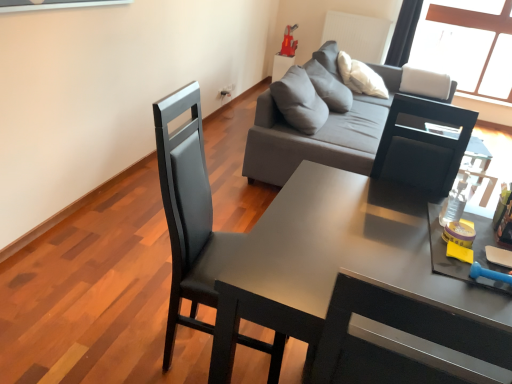
Find the location of a particular element. matte black chair at center-left is located at coordinates (188, 213).

Locate an element on the screen. The width and height of the screenshot is (512, 384). gray fabric side table at upper center is located at coordinates (281, 65).

Looking at this image, what is the approximate width of rubberized red toy at upper center?

The width of rubberized red toy at upper center is 9.20 inches.

This screenshot has height=384, width=512. Describe the element at coordinates (289, 42) in the screenshot. I see `rubberized red toy at upper center` at that location.

Describe the element at coordinates (318, 136) in the screenshot. I see `gray fabric couch at upper center` at that location.

At what (x,y) coordinates should I click in order to perform the action: click on matte black chair at center-left. Please return your answer as a coordinate pair (x, y). The width and height of the screenshot is (512, 384). Looking at the image, I should click on (188, 213).

From a real-world perspective, is gray fabric side table at upper center located beneath gray fabric couch at upper center?

Yes, from a real-world perspective, gray fabric side table at upper center is below gray fabric couch at upper center.

Between gray fabric side table at upper center and gray fabric couch at upper center, which one appears on the left side from the viewer's perspective?

gray fabric side table at upper center is more to the left.

Is gray fabric side table at upper center bigger or smaller than gray fabric couch at upper center?

gray fabric side table at upper center is smaller than gray fabric couch at upper center.

Does gray fabric couch at upper center have a smaller size compared to matte black desk at center?

Incorrect, gray fabric couch at upper center is not smaller in size than matte black desk at center.

Is there a large distance between gray fabric couch at upper center and matte black desk at center?

gray fabric couch at upper center is far away from matte black desk at center.

Is point (328, 146) farther from viewer compared to point (490, 376)?

Yes.

From the image's perspective, is gray fabric couch at upper center above or below matte black desk at center?

Based on their image positions, gray fabric couch at upper center is located above matte black desk at center.

Is rubberized red toy at upper center taller or shorter than matte black chair at center-left?

Clearly, rubberized red toy at upper center is shorter compared to matte black chair at center-left.

Between rubberized red toy at upper center and matte black chair at center-left, which one appears on the right side from the viewer's perspective?

From the viewer's perspective, rubberized red toy at upper center appears more on the right side.

Find the location of `toy lying behind the matte black chair at center-left`. toy lying behind the matte black chair at center-left is located at coordinates (289, 42).

Does rubberized red toy at upper center come behind matte black chair at center-left?

Yes, rubberized red toy at upper center is behind matte black chair at center-left.

Is gray fabric couch at upper center completely or partially outside of gray fabric side table at upper center?

Yes, gray fabric couch at upper center is located beyond the bounds of gray fabric side table at upper center.

Can you confirm if gray fabric couch at upper center is positioned to the left of gray fabric side table at upper center?

Incorrect, gray fabric couch at upper center is not on the left side of gray fabric side table at upper center.

How many degrees apart are the facing directions of gray fabric couch at upper center and gray fabric side table at upper center?

The facing directions of gray fabric couch at upper center and gray fabric side table at upper center are 2.56 degrees apart.

Which object is positioned more to the left, matte black desk at center or rubberized red toy at upper center?

rubberized red toy at upper center is more to the left.

Does matte black desk at center have a greater height compared to rubberized red toy at upper center?

Indeed, matte black desk at center has a greater height compared to rubberized red toy at upper center.

Which point is more distant from viewer, (289, 51) or (291, 57)?

The point (291, 57) is farther.

Which of these two, rubberized red toy at upper center or gray fabric side table at upper center, is smaller?

rubberized red toy at upper center is smaller.

Who is taller, rubberized red toy at upper center or gray fabric side table at upper center?

gray fabric side table at upper center is taller.

Which is more to the left, rubberized red toy at upper center or gray fabric side table at upper center?

gray fabric side table at upper center is more to the left.

Is gray fabric side table at upper center far away from rubberized red toy at upper center?

No, gray fabric side table at upper center is in close proximity to rubberized red toy at upper center.

From a real-world perspective, is gray fabric side table at upper center positioned above or below rubberized red toy at upper center?

From a real-world perspective, gray fabric side table at upper center is physically below rubberized red toy at upper center.

From the image's perspective, does gray fabric side table at upper center appear lower than rubberized red toy at upper center?

Yes, from the image's perspective, gray fabric side table at upper center is beneath rubberized red toy at upper center.

Identify the location of side table that is on the left side of gray fabric couch at upper center. (281, 65).

Locate an element on the screen. studio couch on the right of matte black desk at center is located at coordinates (318, 136).

Based on their spatial positions, is matte black desk at center or matte black chair at center-left closer to rubberized red toy at upper center?

The object closer to rubberized red toy at upper center is matte black chair at center-left.

Considering their positions, is matte black chair at center-left positioned further to gray fabric couch at upper center than rubberized red toy at upper center?

rubberized red toy at upper center is further to gray fabric couch at upper center.

Which object lies nearer to the anchor point gray fabric couch at upper center, rubberized red toy at upper center or gray fabric side table at upper center?

Among the two, gray fabric side table at upper center is located nearer to gray fabric couch at upper center.

Looking at the image, which one is located closer to gray fabric side table at upper center, matte black chair at center-left or rubberized red toy at upper center?

rubberized red toy at upper center lies closer to gray fabric side table at upper center than the other object.

Based on their spatial positions, is rubberized red toy at upper center or gray fabric couch at upper center further from gray fabric side table at upper center?

Based on the image, gray fabric couch at upper center appears to be further to gray fabric side table at upper center.

When comparing their distances from matte black chair at center-left, does matte black desk at center or gray fabric side table at upper center seem further?

Among the two, gray fabric side table at upper center is located further to matte black chair at center-left.

Which object lies further to the anchor point matte black desk at center, gray fabric side table at upper center or gray fabric couch at upper center?

Based on the image, gray fabric side table at upper center appears to be further to matte black desk at center.

From the image, which object appears to be farther from matte black chair at center-left, gray fabric couch at upper center or gray fabric side table at upper center?

gray fabric side table at upper center is further to matte black chair at center-left.

This screenshot has width=512, height=384. I want to click on toy positioned between matte black desk at center and gray fabric side table at upper center from near to far, so click(x=289, y=42).

The image size is (512, 384). I want to click on studio couch between matte black desk at center and gray fabric side table at upper center in the front-back direction, so click(318, 136).

Locate an element on the screen. The image size is (512, 384). toy between gray fabric couch at upper center and gray fabric side table at upper center from front to back is located at coordinates pyautogui.click(x=289, y=42).

Where is `toy between matte black chair at center-left and gray fabric side table at upper center in the front-back direction`? toy between matte black chair at center-left and gray fabric side table at upper center in the front-back direction is located at coordinates (289, 42).